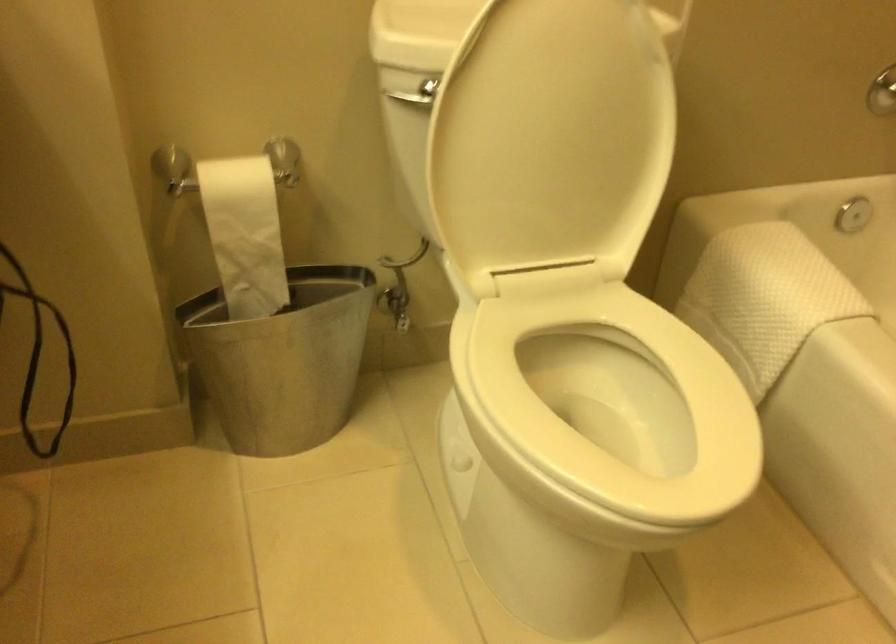
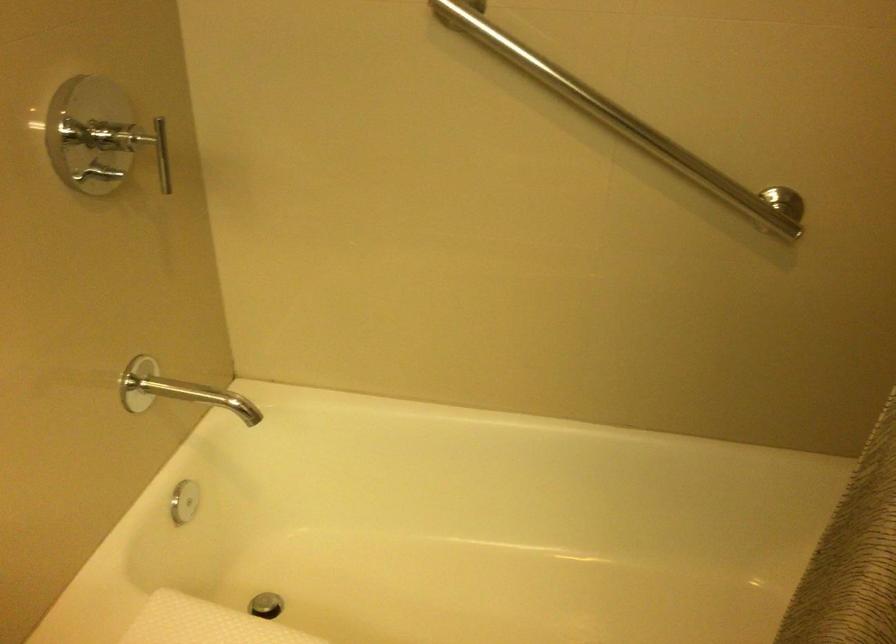
Question: The camera is either moving clockwise (left) or counter-clockwise (right) around the object. The first image is from the beginning of the video and the second image is from the end. Is the camera moving left or right when shooting the video?

Choices:
 (A) Left
 (B) Right

Answer: (A)